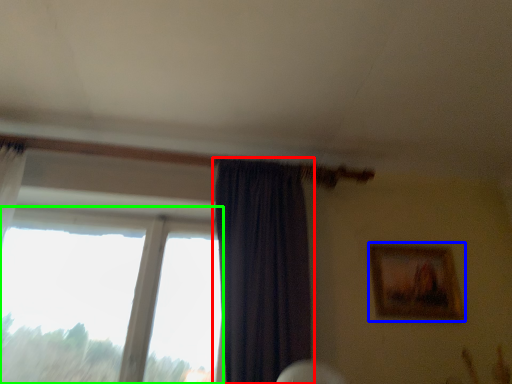
Question: Which object is positioned closest to curtain (highlighted by a red box)? Select from picture frame (highlighted by a blue box) and window (highlighted by a green box).

Choices:
 (A) picture frame
 (B) window

Answer: (B)